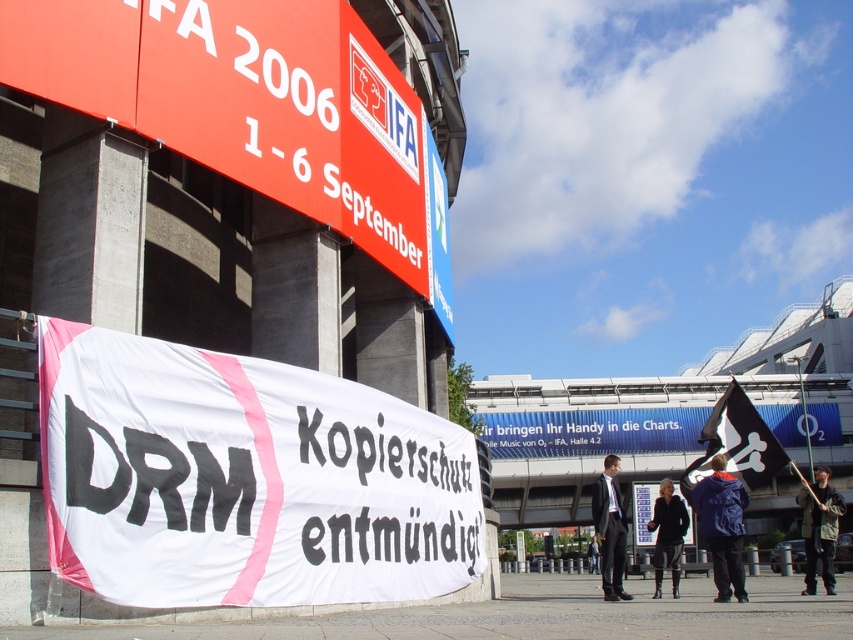
Based on the photo, you are a photographer standing in front of the banner and the building. You notice two people in the crowd wearing dark gray suit at center and black leather jacket at center. If you want to take a photo that includes both individuals, which person should be positioned closer to the camera to ensure both are visible without obstruction?

The dark gray suit at center should be positioned closer to the camera because it is already in front of the black leather jacket at center, so moving it forward would keep both visible without obstruction.

You are a photographer at the IFA 2006 event. You see a person wearing a camouflage jacket at right and another wearing a dark gray suit at center. Which person is standing higher in the image?

The camouflage jacket at right is located above the dark gray suit at center, so the person wearing the camouflage jacket at right is standing higher in the image.

You are a photographer at the event and need to capture both the white fabric banner at upper center and the dark gray suit at center in a single frame. Given their sizes, which object should you zoom in on to ensure both are visible without cropping?

The white fabric banner at upper center has a lesser width compared to dark gray suit at center, so you should zoom in on the dark gray suit at center to ensure both objects fit within the frame.